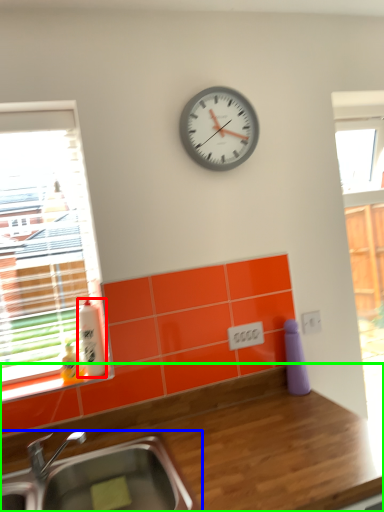
Question: Which object is positioned closest to bottle (highlighted by a red box)? Select from sink (highlighted by a blue box) and countertop (highlighted by a green box).

Choices:
 (A) sink
 (B) countertop

Answer: (A)